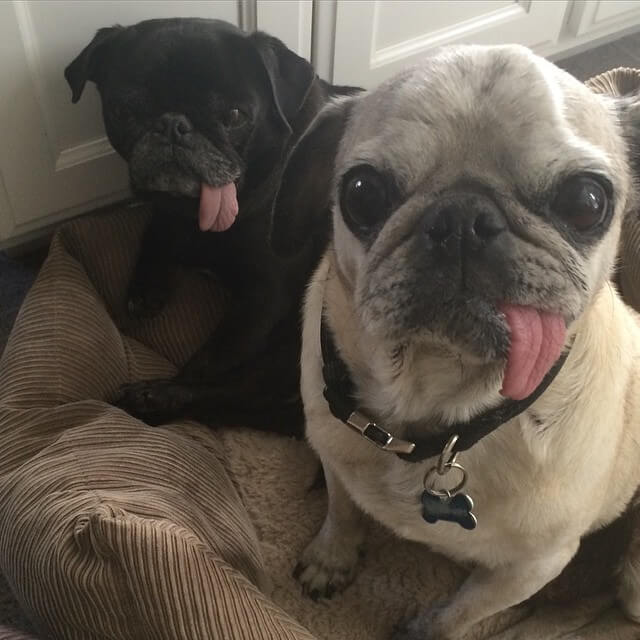
Find the location of a particular element. This screenshot has width=640, height=640. cabinets is located at coordinates (349, 31).